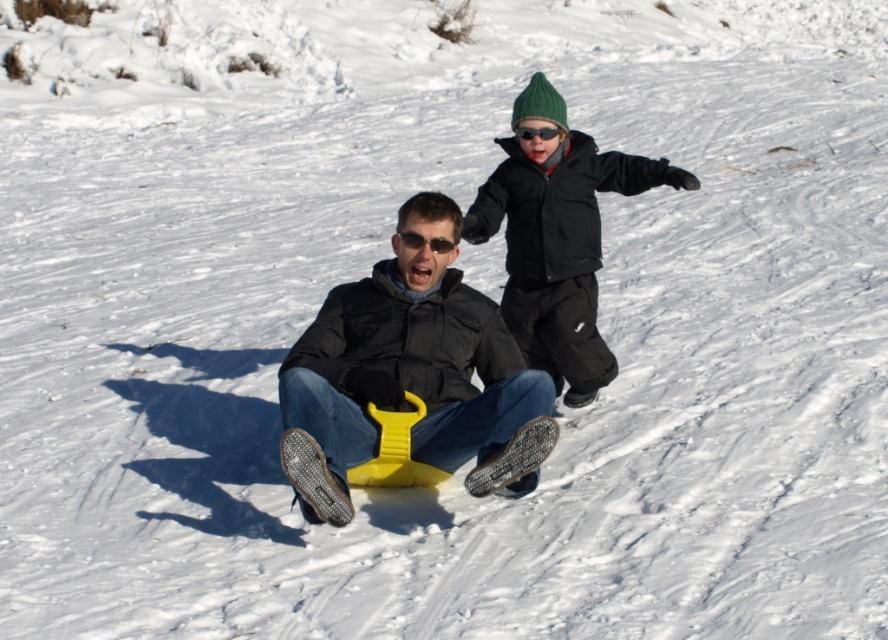
Based on the photo, can you confirm if green knit hat at upper right is wider than black plastic goggles at upper center?

Indeed, green knit hat at upper right has a greater width compared to black plastic goggles at upper center.

Between green knit hat at upper right and black plastic goggles at upper center, which one is positioned lower?

green knit hat at upper right is lower down.

I want to click on green knit hat at upper right, so click(x=557, y=236).

You are a GUI agent. You are given a task and a screenshot of the screen. Output one action in this format:
    pyautogui.click(x=<x>, y=<y>)
    Task: Click on the green knit hat at upper right
    
    Given the screenshot: What is the action you would take?
    pyautogui.click(x=557, y=236)

Which is below, matte black jacket at center or green knit hat at upper right?

matte black jacket at center is below.

Is matte black jacket at center to the left of green knit hat at upper right from the viewer's perspective?

Correct, you'll find matte black jacket at center to the left of green knit hat at upper right.

Which is behind, point (345, 397) or point (568, 316)?

Point (568, 316)

In order to click on matte black jacket at center in this screenshot , I will do `click(411, 374)`.

Is yellow plastic sled at center above black plastic goggles at upper center?

No, yellow plastic sled at center is not above black plastic goggles at upper center.

This screenshot has width=888, height=640. What do you see at coordinates (466, 323) in the screenshot? I see `yellow plastic sled at center` at bounding box center [466, 323].

At what (x,y) coordinates should I click in order to perform the action: click on yellow plastic sled at center. Please return your answer as a coordinate pair (x, y). Looking at the image, I should click on (466, 323).